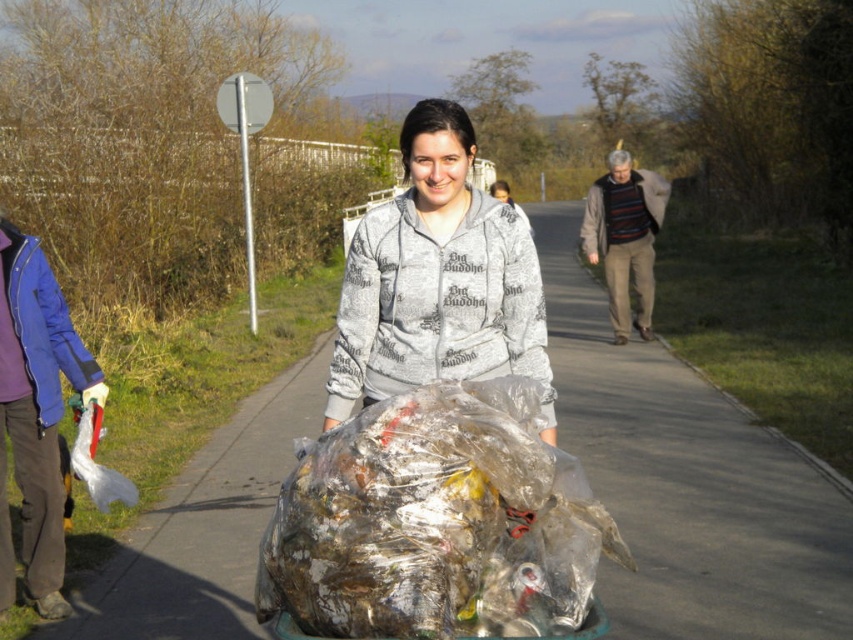
At what (x,y) coordinates should I click in order to perform the action: click on translucent plastic bag at center. Please return your answer as a coordinate pair (x, y). This screenshot has width=853, height=640. Looking at the image, I should click on (436, 522).

How distant is translucent plastic bag at center from gray printed hoodie at center?

A distance of 33.31 inches exists between translucent plastic bag at center and gray printed hoodie at center.

Does point (364, 509) come behind point (505, 260)?

That is False.

This screenshot has height=640, width=853. I want to click on translucent plastic bag at center, so click(436, 522).

Does clear asphalt pavement at center have a lesser width compared to translucent plastic bag at center?

No.

Who is more forward, (703, 604) or (306, 611)?

Point (306, 611)

Locate an element on the screen. The height and width of the screenshot is (640, 853). clear asphalt pavement at center is located at coordinates (688, 483).

Is clear asphalt pavement at center taller than striped sweater at center?

No.

Does point (790, 627) come behind point (650, 257)?

No, it is not.

I want to click on clear asphalt pavement at center, so click(x=688, y=483).